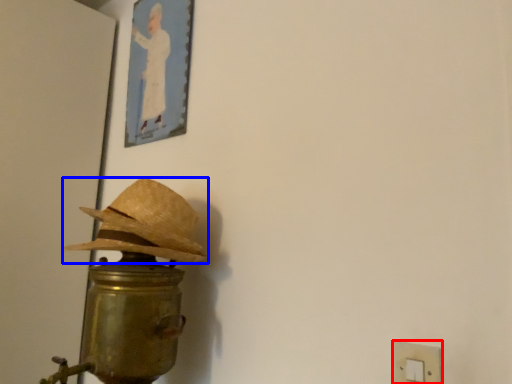
Question: Which object is further to the camera taking this photo, light switch (highlighted by a red box) or hat (highlighted by a blue box)?

Choices:
 (A) light switch
 (B) hat

Answer: (B)